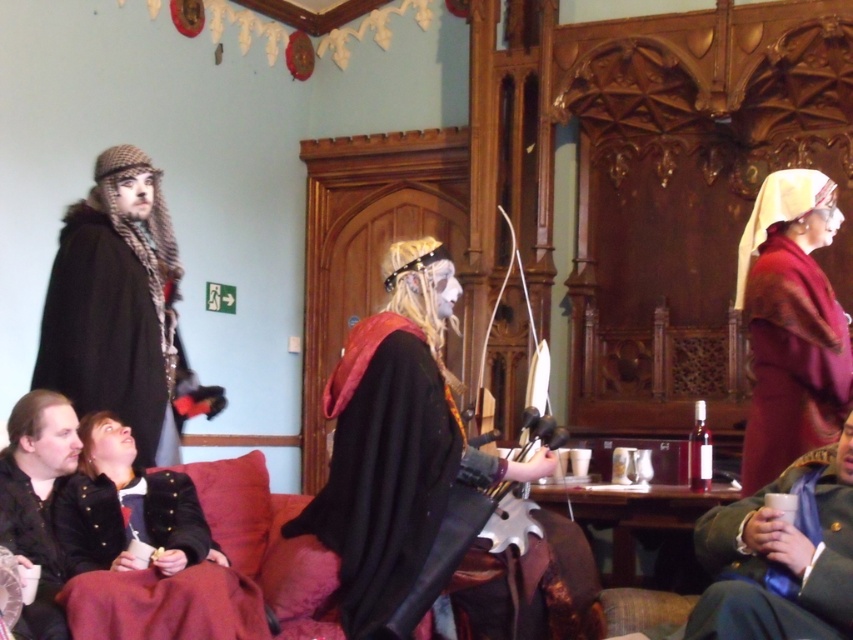
You are a costume designer preparing for a play. You need to arrange two costumes on a display rack. The dark brown woolen robe at left and the black leather jacket at lower left must be placed according to their positions in the original image. Which costume should be placed to the left of the other?

The dark brown woolen robe at left should be placed to the left of the black leather jacket at lower left because in the original image, the dark brown woolen robe at left is positioned on the left side of the black leather jacket at lower left.

From the picture: You are an actor in a play and need to position yourself exactly where the matte black cape at center is located. What are the coordinates of the spot where you should stand?

The coordinates for the matte black cape at center are at point [395,440].